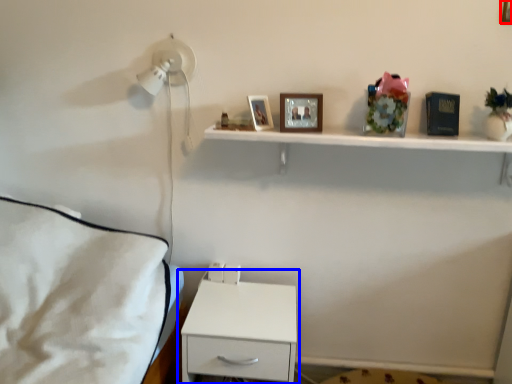
Question: Which object is closer to the camera taking this photo, picture frame (highlighted by a red box) or nightstand (highlighted by a blue box)?

Choices:
 (A) picture frame
 (B) nightstand

Answer: (A)